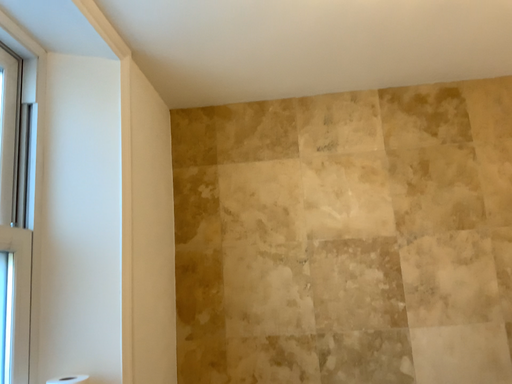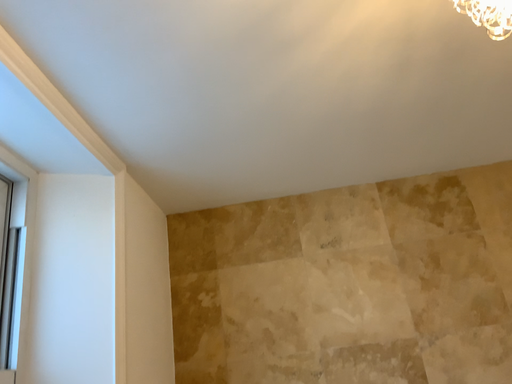
Question: Which way did the camera rotate in the video?

Choices:
 (A) rotated downward
 (B) rotated upward

Answer: (B)